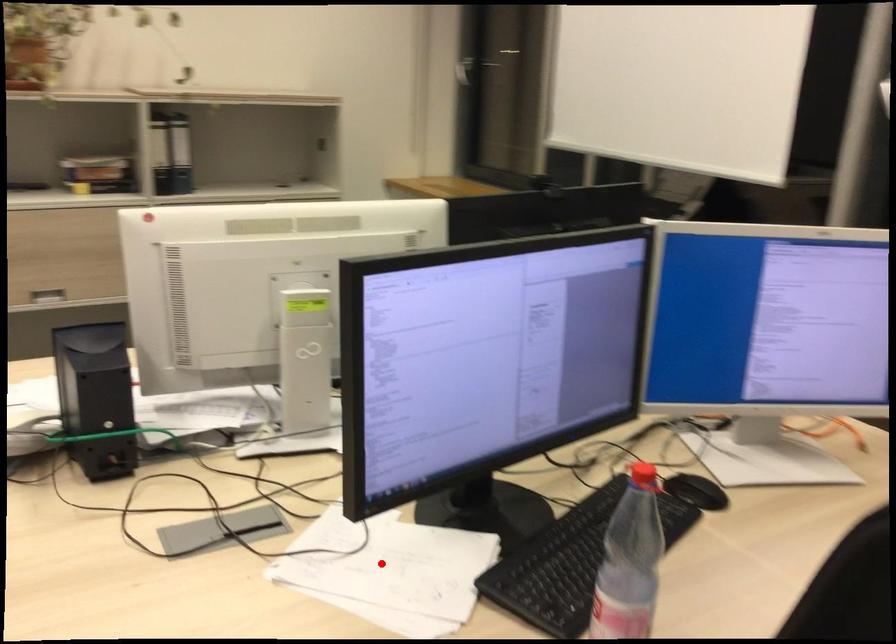
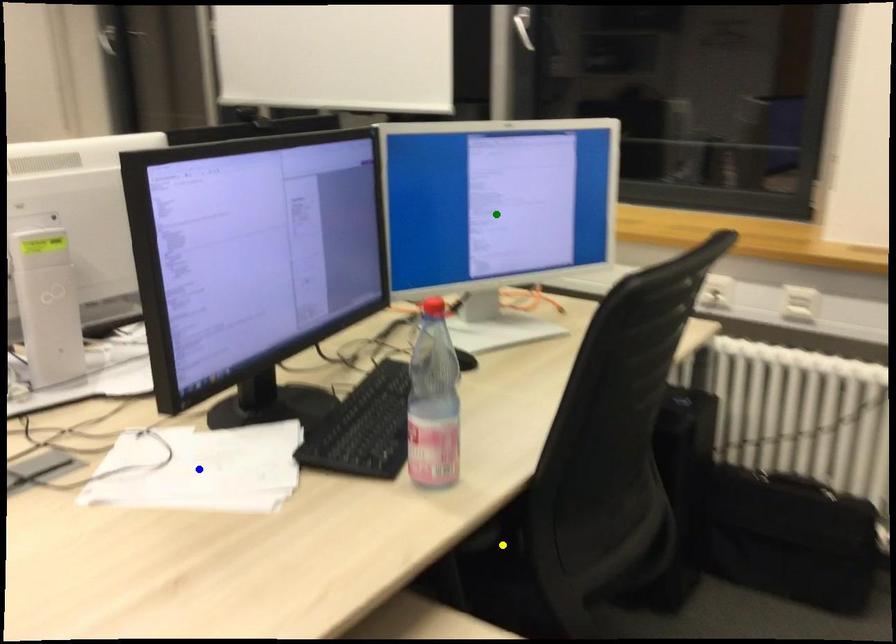
Question: I am providing you with two images of the same scene from different viewpoints. A red point is marked on the first image. You are given multiple points on the second image. Can you choose the point in image 2 that corresponds to the point in image 1?

Choices:
 (A) blue point
 (B) yellow point
 (C) green point

Answer: (A)